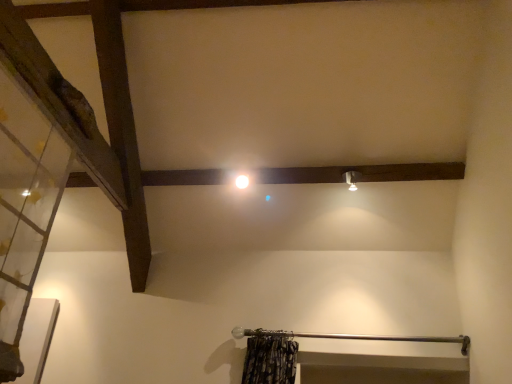
Question: Could you tell me if metallic curtain rod at lower center is facing transparent glass door at left?

Choices:
 (A) yes
 (B) no

Answer: (A)

Question: Is metallic curtain rod at lower center next to transparent glass door at left?

Choices:
 (A) no
 (B) yes

Answer: (A)

Question: Would you say metallic curtain rod at lower center is outside transparent glass door at left?

Choices:
 (A) no
 (B) yes

Answer: (B)

Question: Can you confirm if metallic curtain rod at lower center is smaller than transparent glass door at left?

Choices:
 (A) no
 (B) yes

Answer: (B)

Question: Does metallic curtain rod at lower center have a larger size compared to transparent glass door at left?

Choices:
 (A) no
 (B) yes

Answer: (A)

Question: Considering the relative sizes of metallic curtain rod at lower center and transparent glass door at left in the image provided, is metallic curtain rod at lower center taller than transparent glass door at left?

Choices:
 (A) yes
 (B) no

Answer: (B)

Question: Is metallic curtain rod at lower center smaller than white glossy light at center?

Choices:
 (A) yes
 (B) no

Answer: (B)

Question: Considering the relative positions of metallic curtain rod at lower center and white glossy light at center in the image provided, is metallic curtain rod at lower center behind white glossy light at center?

Choices:
 (A) no
 (B) yes

Answer: (A)

Question: Does metallic curtain rod at lower center have a larger size compared to white glossy light at center?

Choices:
 (A) yes
 (B) no

Answer: (A)

Question: Does metallic curtain rod at lower center have a greater width compared to white glossy light at center?

Choices:
 (A) no
 (B) yes

Answer: (B)

Question: Does metallic curtain rod at lower center appear on the right side of white glossy light at center?

Choices:
 (A) no
 (B) yes

Answer: (B)

Question: Can we say metallic curtain rod at lower center lies outside white glossy light at center?

Choices:
 (A) no
 (B) yes

Answer: (B)

Question: Is metallic curtain rod at lower center next to matte silver light fixture at upper right?

Choices:
 (A) yes
 (B) no

Answer: (B)